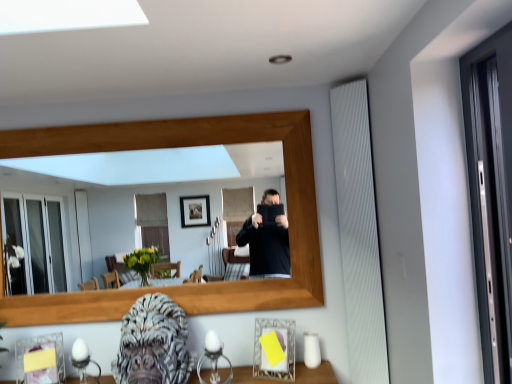
You are a GUI agent. You are given a task and a screenshot of the screen. Output one action in this format:
    pyautogui.click(x=<x>, y=<y>)
    Task: Click on the vacant region above wooden frame at center (from a real-world perspective)
    The image size is (512, 384).
    Given the screenshot: What is the action you would take?
    pyautogui.click(x=152, y=112)